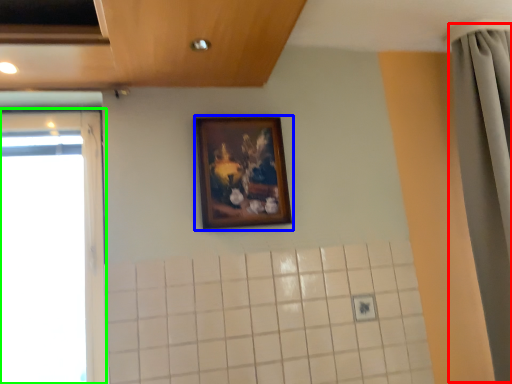
Question: Which is farther away from shower curtain (highlighted by a red box)? picture frame (highlighted by a blue box) or window (highlighted by a green box)?

Choices:
 (A) picture frame
 (B) window

Answer: (B)